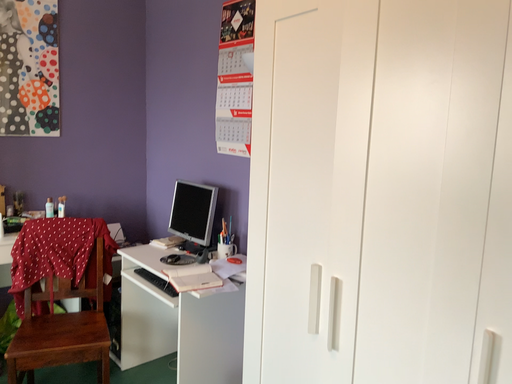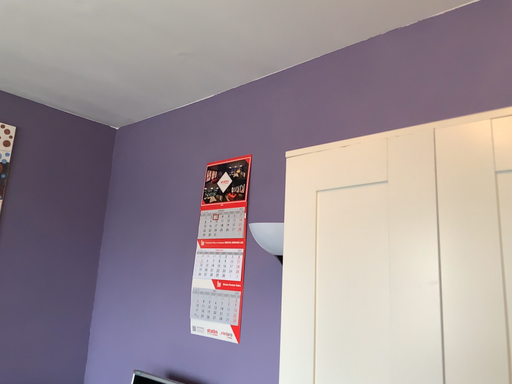
Question: Which way did the camera rotate in the video?

Choices:
 (A) rotated right
 (B) rotated left

Answer: (A)